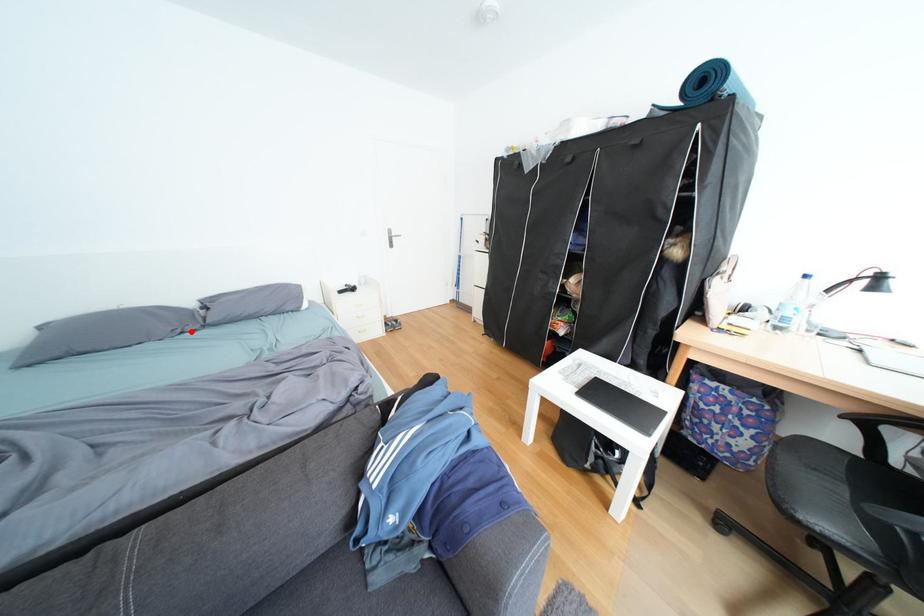
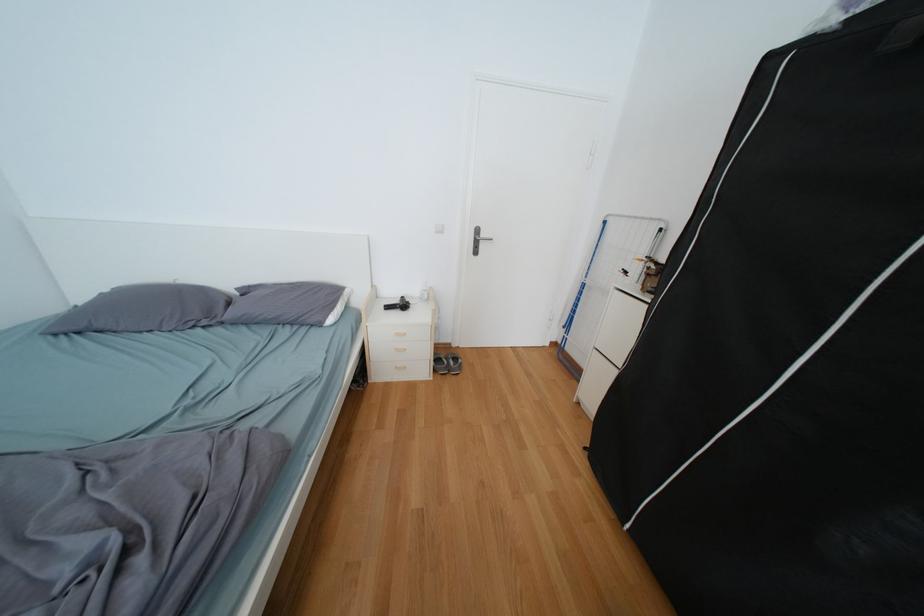
The point at the highlighted location is marked in the first image. Where is the corresponding point in the second image?

(204, 323)